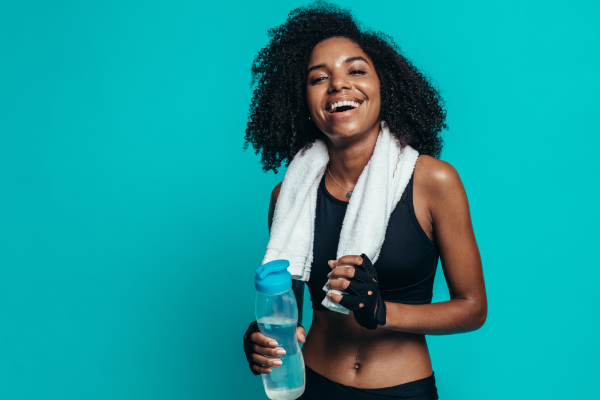
The width and height of the screenshot is (600, 400). I want to click on towel, so click(x=374, y=193).